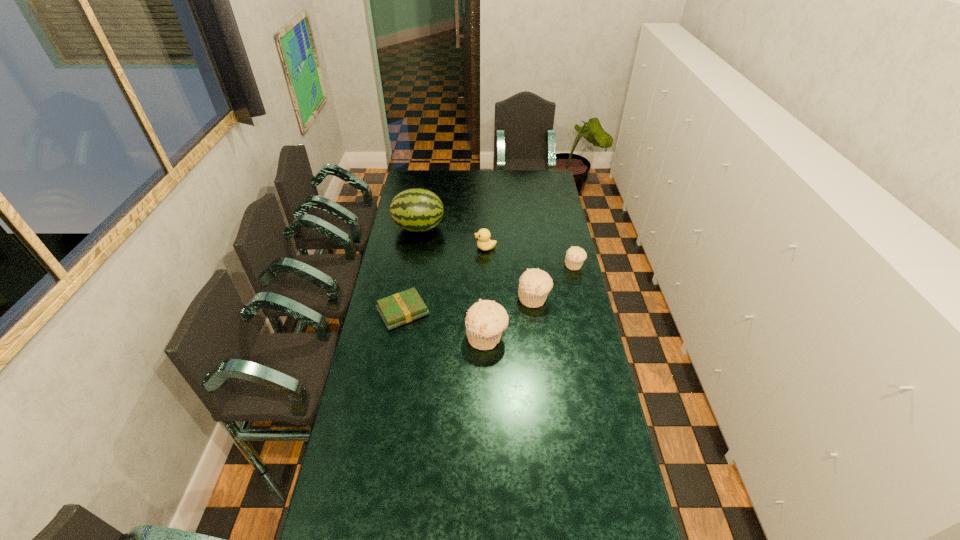
Find the location of a particular element. The width and height of the screenshot is (960, 540). vacant space in between the book and the rightmost muffin is located at coordinates (489, 288).

Locate an element on the screen. This screenshot has width=960, height=540. free area in between the farthest object and the shortest object is located at coordinates point(411,270).

Find the location of a particular element. The width and height of the screenshot is (960, 540). empty space that is in between the nearest muffin and the farthest object is located at coordinates (453, 282).

Find the location of a particular element. Image resolution: width=960 pixels, height=540 pixels. vacant space in between the watermelon and the third tallest object is located at coordinates (476, 263).

You are a GUI agent. You are given a task and a screenshot of the screen. Output one action in this format:
    pyautogui.click(x=<x>, y=<y>)
    Task: Click on the object that is the third closest to the fourth shortest object
    
    Given the screenshot: What is the action you would take?
    pyautogui.click(x=484, y=243)

Where is `object that can be found as the second closest to the third farthest object`? object that can be found as the second closest to the third farthest object is located at coordinates (484, 243).

At what (x,y) coordinates should I click in order to perform the action: click on muffin that is the second nearest to the leftmost muffin. Please return your answer as a coordinate pair (x, y). Looking at the image, I should click on (575, 256).

Select which muffin appears as the second closest to the shortest muffin. Please provide its 2D coordinates. Your answer should be formatted as a tuple, i.e. [(x, y)], where the tuple contains the x and y coordinates of a point satisfying the conditions above.

[(485, 321)]

This screenshot has height=540, width=960. Identify the location of free space that satisfies the following two spatial constraints: 1. on the face of the second farthest object; 2. on the left side of the farthest muffin. (486, 265).

Identify the location of vacant space that satisfies the following two spatial constraints: 1. on the back side of the nearest muffin; 2. on the right side of the shortest muffin. The image size is (960, 540). (486, 265).